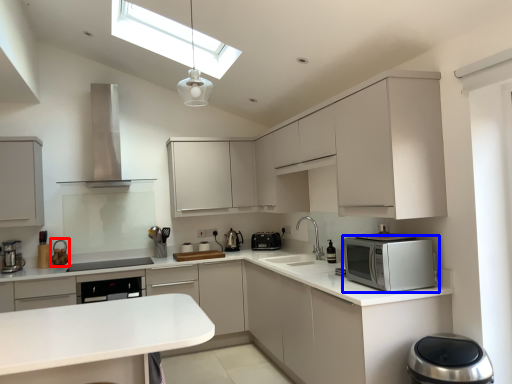
Question: Which object appears closest to the camera in this image, appliance (highlighted by a red box) or home appliance (highlighted by a blue box)?

Choices:
 (A) appliance
 (B) home appliance

Answer: (B)